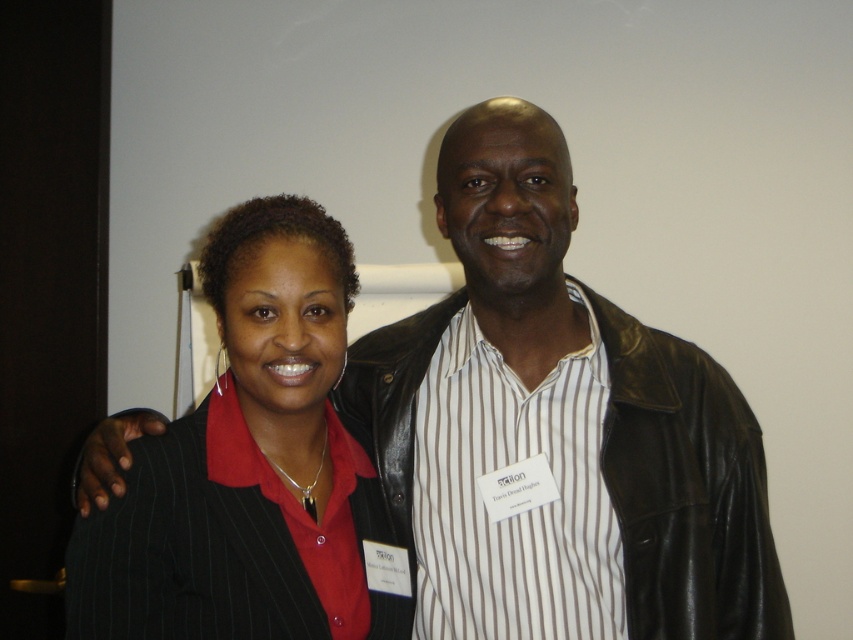
Does point (753, 451) come closer to viewer compared to point (283, 298)?

No, (753, 451) is further to viewer.

This screenshot has width=853, height=640. What do you see at coordinates (573, 406) in the screenshot?
I see `black leather jacket at center` at bounding box center [573, 406].

Identify the location of black leather jacket at center. (573, 406).